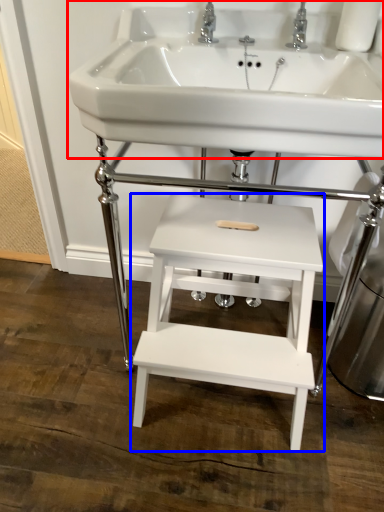
Question: Which object appears farthest to the camera in this image, sink (highlighted by a red box) or table (highlighted by a blue box)?

Choices:
 (A) sink
 (B) table

Answer: (B)